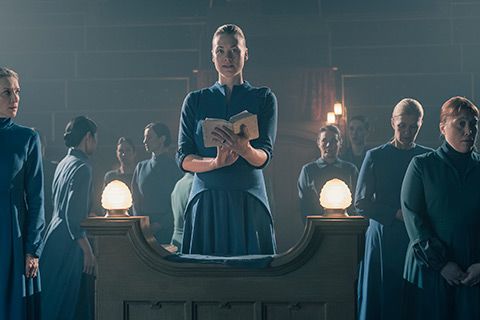
Identify the location of red curtains. (315, 91).